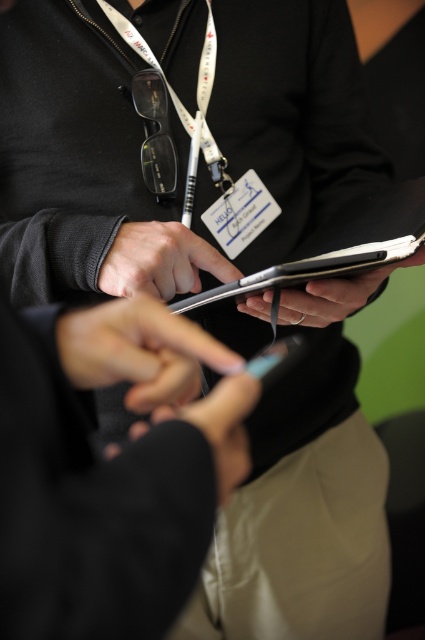
You are taking a photo of two points in the image. The first point is labeled as point (124, 248) and the second is point (144, 44). Which point will appear larger in your photo?

Point (124, 248) is closer to the camera than point (144, 44), so it will appear larger in the photo.

You are a photographer trying to capture a clear shot of the satin black phone at center and the smooth black glove at center. Since the glove is moving, you want to focus on the phone first. Based on their positions, which object should you aim your camera at first?

The satin black phone at center is located above the smooth black glove at center, so you should aim your camera at the satin black phone at center first to ensure it stays in focus before the glove moves.

You are trying to locate your phone and tablet during a presentation. You remember that the satin black phone at center is to the left of the matte black tablet at center. Which object should you look for first if you want to find the tablet?

You should look for the matte black tablet at center first since the satin black phone at center is to its left, meaning the tablet is positioned to the right of the phone.